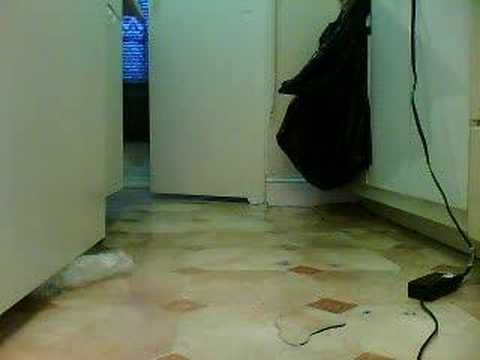
The height and width of the screenshot is (360, 480). I want to click on space where the door is open, so click(x=135, y=105).